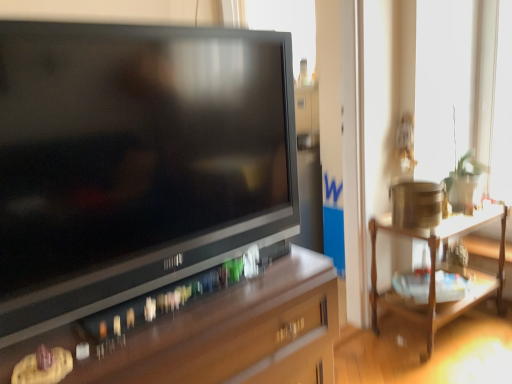
Question: Is point (384, 230) positioned closer to the camera than point (130, 104)?

Choices:
 (A) closer
 (B) farther

Answer: (B)

Question: From a real-world perspective, is wooden table at right positioned above or below matte black television at center?

Choices:
 (A) above
 (B) below

Answer: (B)

Question: Which of these objects is positioned farthest from the wooden table at right?

Choices:
 (A) matte black television at center
 (B) brown wood desk at lower left

Answer: (A)

Question: Estimate the real-world distances between objects in this image. Which object is closer to the wooden table at right?

Choices:
 (A) matte black television at center
 (B) brown wood desk at lower left

Answer: (B)